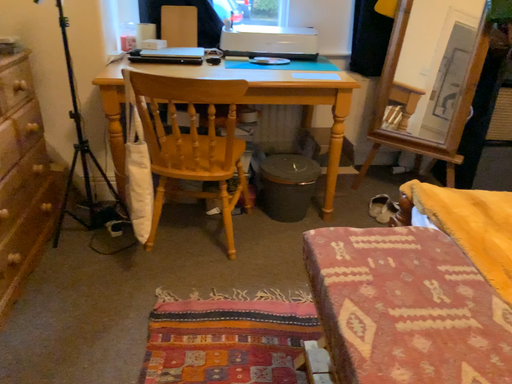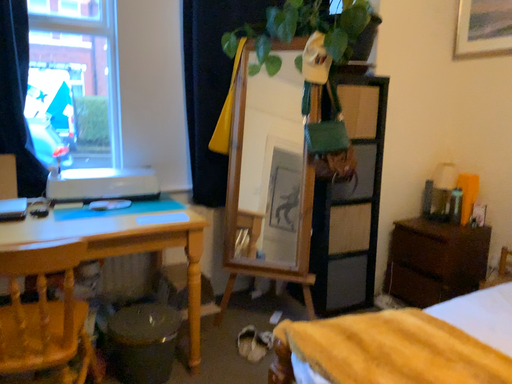
Question: Which way did the camera rotate in the video?

Choices:
 (A) rotated downward
 (B) rotated upward

Answer: (B)